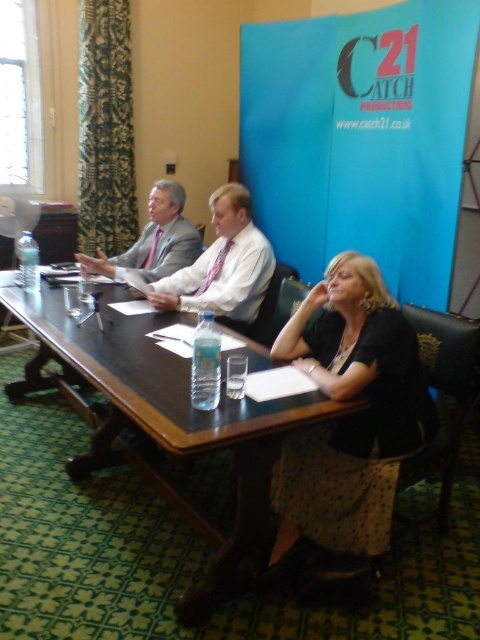
From the picture: You are organizing a small presentation and need to place a laptop on the table. The laptop requires a minimum of 50 cm of space. Given the dark wood table at center and the matte pink tie at center, can you determine if the table has enough space based on their sizes?

The dark wood table at center is larger in width than the matte pink tie at center. Since the laptop requires 50 cm of space, and the table is wider than the tie, it is likely that the table has sufficient space to accommodate the laptop.

You are a photographer standing in front of the conference table. You want to capture a closeup shot of the matte pink tie at center without moving any objects. Can you get close enough to focus on the tie clearly?

The matte pink tie at center is 2.54 meters away from viewer, so you can get close enough to focus on the tie clearly as most cameras can focus at that distance.